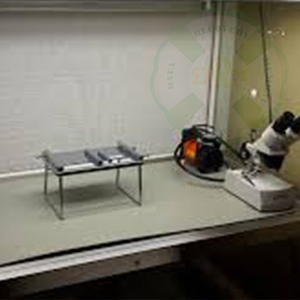
Where is `wall`? wall is located at coordinates (159, 55).